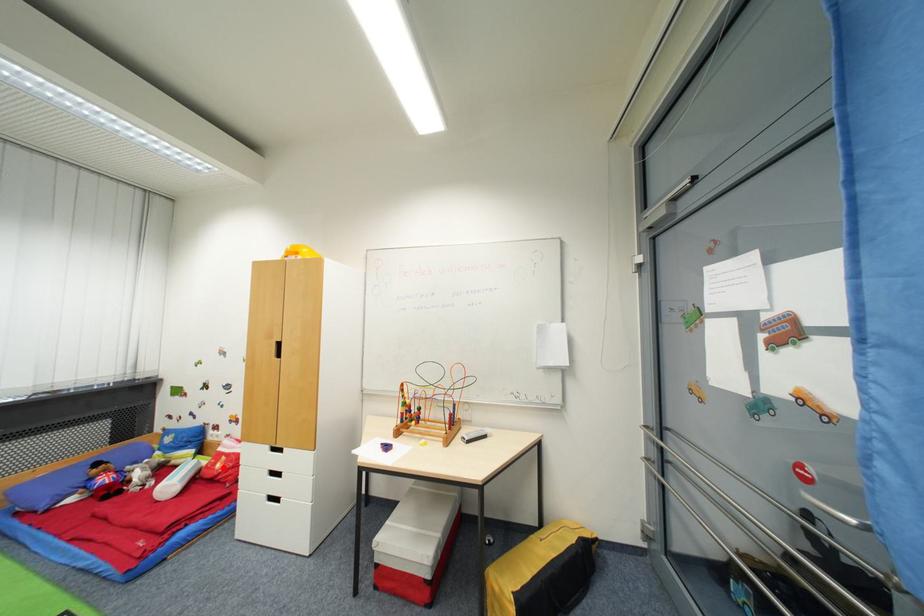
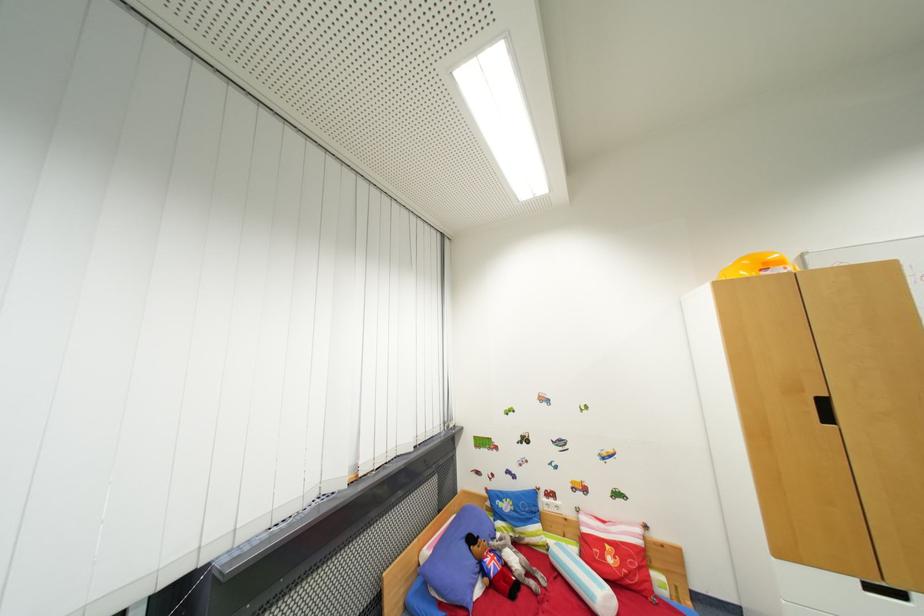
Question: I am providing you with two images of the same scene from different viewpoints. A red point is shown in image1. For the corresponding object point in image2, is it positioned nearer or farther from the camera?

Choices:
 (A) Nearer
 (B) Farther

Answer: (A)